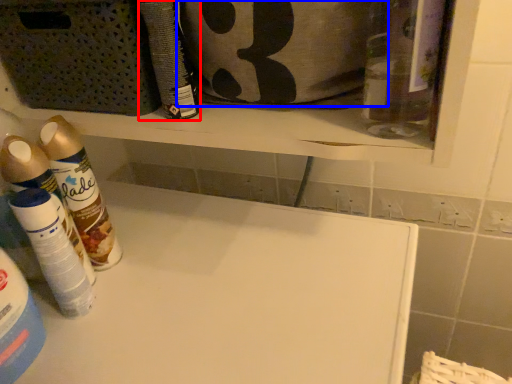
Question: Among these objects, which one is farthest to the camera, cleaning product (highlighted by a red box) or pouch (highlighted by a blue box)?

Choices:
 (A) cleaning product
 (B) pouch

Answer: (A)